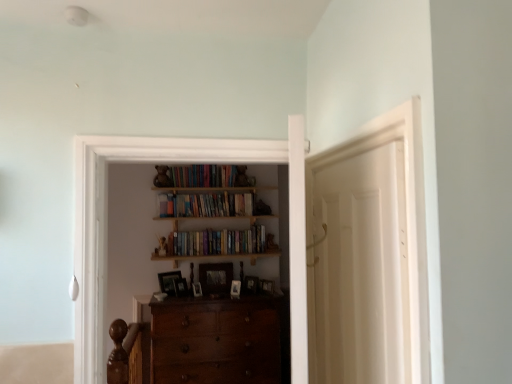
You are a GUI agent. You are given a task and a screenshot of the screen. Output one action in this format:
    pyautogui.click(x=<x>, y=<y>)
    Task: Click on the unoccupied area in front of wooden picture frame at center, which ranks as the first picture frame in right-to-left order
    The height and width of the screenshot is (384, 512).
    Given the screenshot: What is the action you would take?
    pyautogui.click(x=264, y=304)